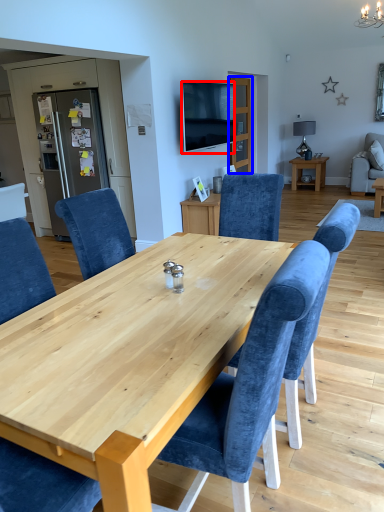
Question: Which point is further to the camera, television (highlighted by a red box) or glass door (highlighted by a blue box)?

Choices:
 (A) television
 (B) glass door

Answer: (B)